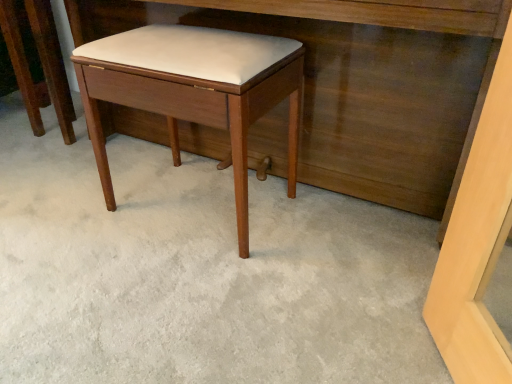
Identify the location of vacant space to the right of matte wood stool at center. (328, 227).